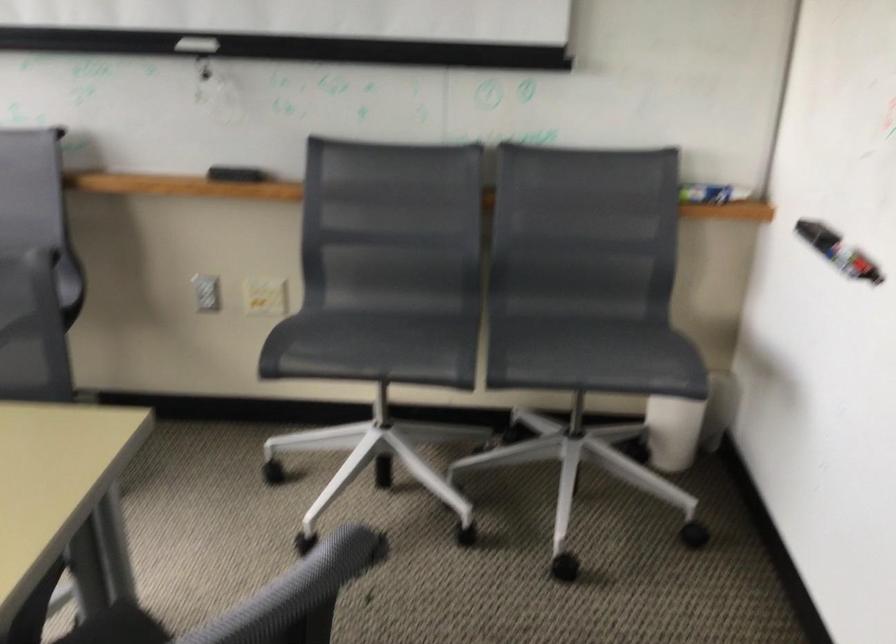
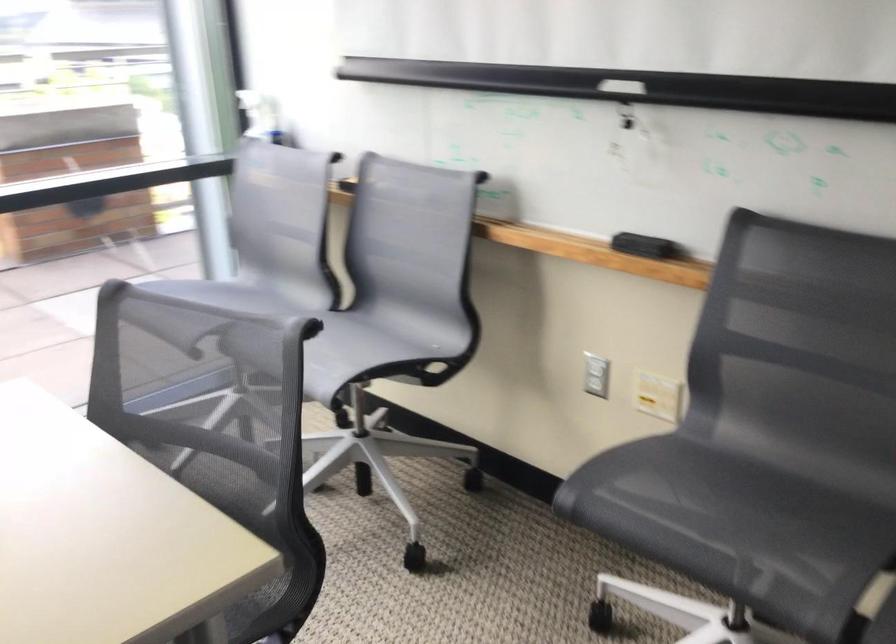
Locate, in the second image, the point that corresponds to (x=243, y=172) in the first image.

(643, 245)